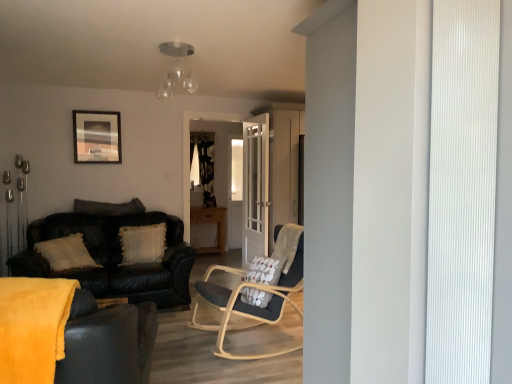
The height and width of the screenshot is (384, 512). In order to click on blank space situated above clear glass chandelier at upper center (from a real-world perspective) in this screenshot , I will do `click(175, 49)`.